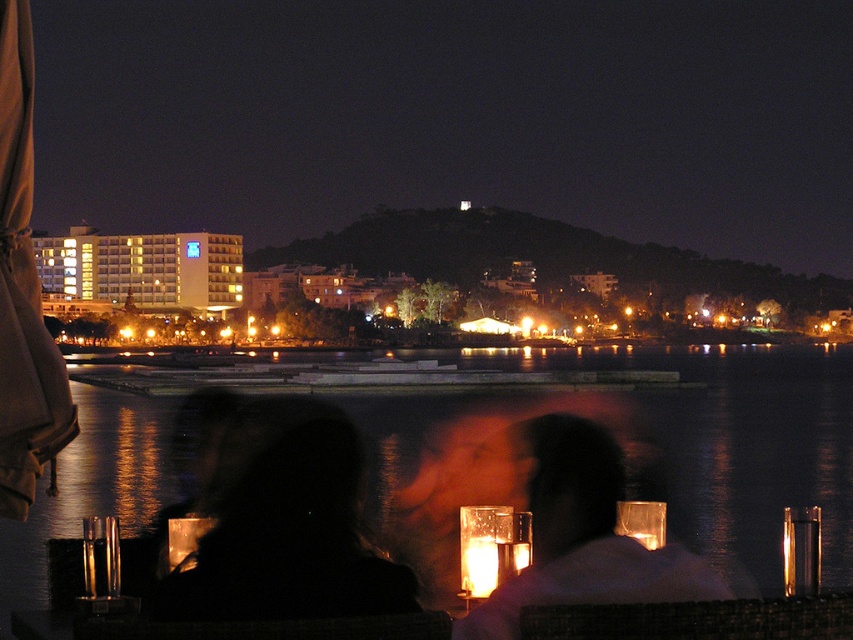
Question: Which of the following is the farthest from the observer?

Choices:
 (A) (602, 522)
 (B) (277, 426)

Answer: (B)

Question: In this image, where is silhouette glass at lower center located relative to black matte hair at center?

Choices:
 (A) above
 (B) below

Answer: (B)

Question: Which of the following is the closest to the observer?

Choices:
 (A) silhouette glass at lower center
 (B) black matte hair at center

Answer: (B)

Question: Among these points, which one is farthest from the camera?

Choices:
 (A) (233, 401)
 (B) (601, 451)

Answer: (A)

Question: Is silhouette glass at lower center thinner than black matte hair at center?

Choices:
 (A) no
 (B) yes

Answer: (A)

Question: Does silhouette glass at lower center appear under black matte hair at center?

Choices:
 (A) yes
 (B) no

Answer: (A)